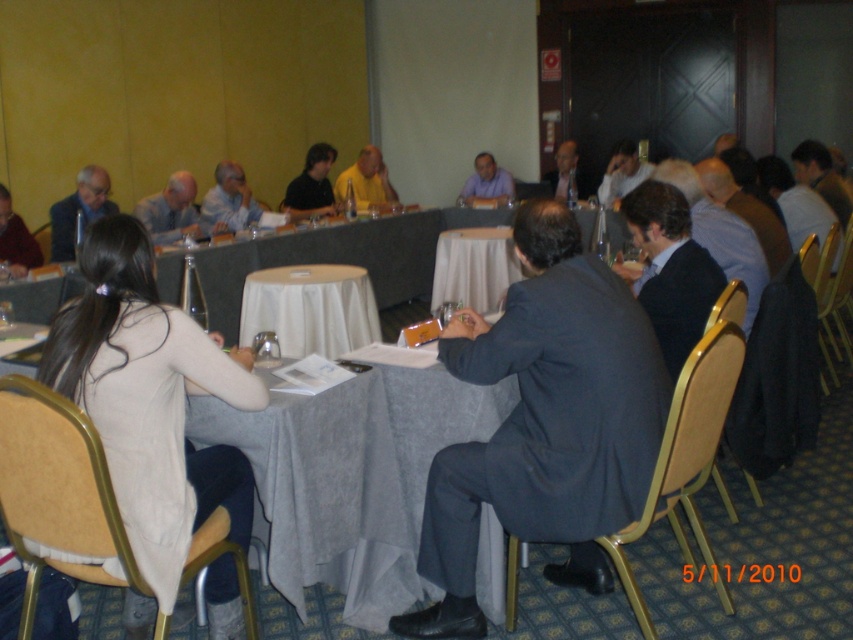
Question: Which of these objects is positioned farthest from the matte black shirt at center?

Choices:
 (A) yellow matte shirt at center
 (B) dark blue suit at center
 (C) matte black suit at left
 (D) light gray suit at center

Answer: (B)

Question: Can you confirm if dark blue suit at center is positioned to the left of light brown leather jacket at upper center?

Choices:
 (A) yes
 (B) no

Answer: (A)

Question: Based on their relative distances, which object is nearer to the yellow matte shirt at center?

Choices:
 (A) gray fabric table at center
 (B) light gray suit at center
 (C) light blue shirt at center
 (D) matte gray suit at center

Answer: (D)

Question: Can you confirm if matte black shirt at center is positioned to the left of dark gray suit at left?

Choices:
 (A) yes
 (B) no

Answer: (B)

Question: From the image, what is the correct spatial relationship of light gray suit at center in relation to matte black suit at left?

Choices:
 (A) above
 (B) below

Answer: (A)

Question: Among these points, which one is nearest to the camera?

Choices:
 (A) (338, 180)
 (B) (183, 179)

Answer: (B)